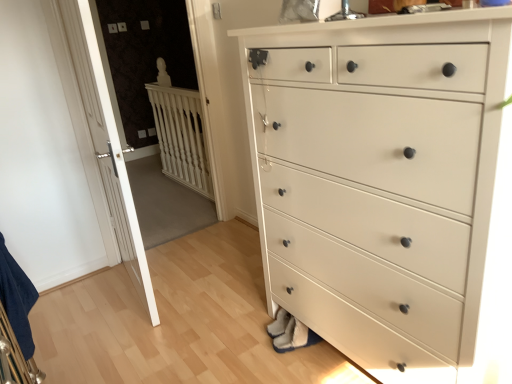
You are a GUI agent. You are given a task and a screenshot of the screen. Output one action in this format:
    pyautogui.click(x=<x>, y=<y>)
    Task: Click on the vacant area that is in front of white wooden door at left
    
    Given the screenshot: What is the action you would take?
    pyautogui.click(x=131, y=332)